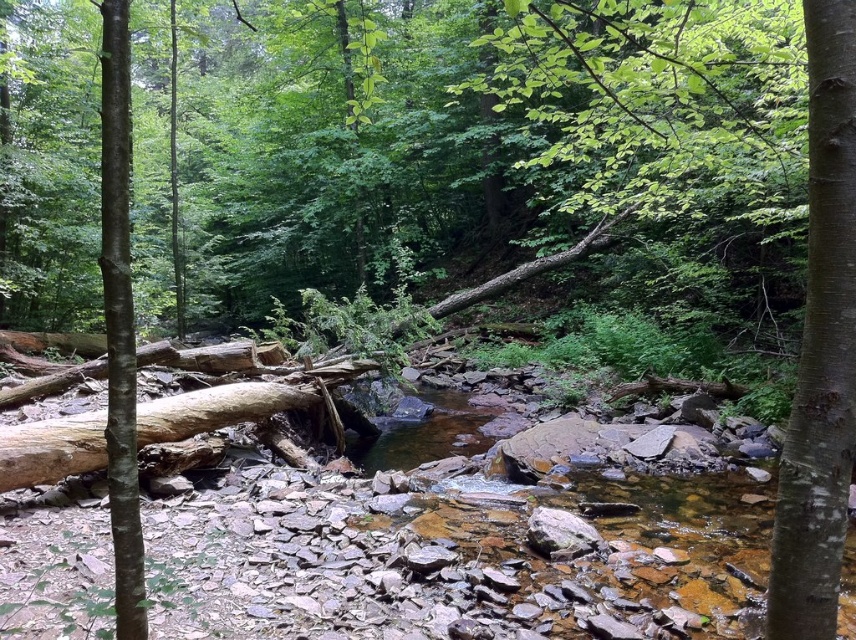
Question: Among these objects, which one is farthest from the camera?

Choices:
 (A) white smooth tree trunk at center
 (B) smooth brown tree trunk at left

Answer: (B)

Question: Can you confirm if white smooth tree trunk at center is thinner than smooth brown tree trunk at left?

Choices:
 (A) yes
 (B) no

Answer: (A)

Question: Which of the following is the farthest from the observer?

Choices:
 (A) white smooth tree trunk at center
 (B) smooth brown tree trunk at left

Answer: (B)

Question: Is white smooth tree trunk at center further to the viewer compared to smooth brown tree trunk at left?

Choices:
 (A) yes
 (B) no

Answer: (B)

Question: Can you confirm if white smooth tree trunk at center is wider than smooth brown tree trunk at left?

Choices:
 (A) yes
 (B) no

Answer: (B)